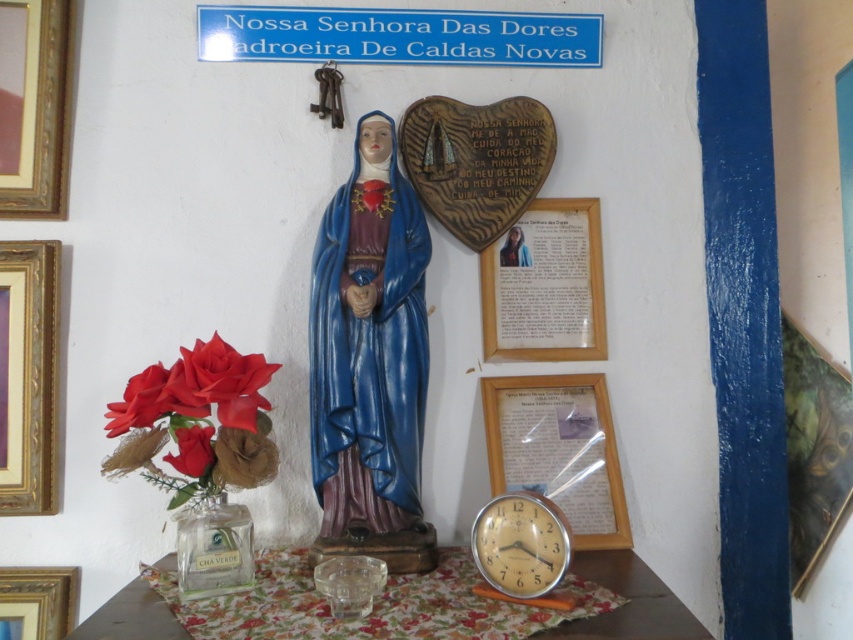
As you stand in front of the religious altar, you notice both the metallic gold picture frame at right and the metallic gold clock at lower center. Which of these two objects is larger in size?

The metallic gold picture frame at right is bigger than the metallic gold clock at lower center according to the description provided.

You are an interior designer planning to add a new shelf to the altar area. You need to know the spatial relationship between the metallic gold picture frame at right and the metallic gold clock at lower center to ensure the shelf placement won

The metallic gold clock at lower center is behind the metallic gold picture frame at right, so placing the shelf in front of the frame would block the view of the clock. Consider positioning the shelf either to the side of the frame or above it to maintain visibility of both items.

You are standing in front of the religious altar and want to place a small candle on the closest frame to you. Which frame should you choose between the matte glass picture frame at lower right and the wooden picture frame at lower left?

The matte glass picture frame at lower right is closer to you than the wooden picture frame at lower left, so you should place the candle on the matte glass picture frame at lower right.